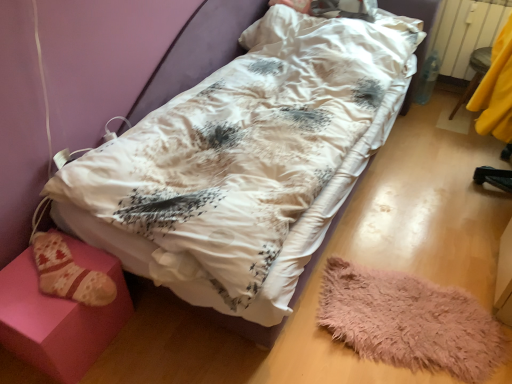
Question: In the image, is white satin hospital bed at center positioned in front of or behind pink fabric stool at lower left, which appears as the first furniture when viewed from the left?

Choices:
 (A) front
 (B) behind

Answer: (A)

Question: Do you think white satin hospital bed at center is within pink fabric stool at lower left, the first furniture ordered from the bottom, or outside of it?

Choices:
 (A) inside
 (B) outside

Answer: (B)

Question: Based on their relative distances, which object is farther from the white satin hospital bed at center?

Choices:
 (A) fluffy pink mat at lower right
 (B) white plastic radiator at upper right
 (C) pink fabric stool at lower left, which is the 2th furniture in back-to-front order
 (D) yellow fabric at right, arranged as the second furniture when viewed from the front

Answer: (D)

Question: Which object is positioned farthest from the fluffy pink mat at lower right?

Choices:
 (A) white satin hospital bed at center
 (B) white plastic radiator at upper right
 (C) pink fabric stool at lower left, the second furniture viewed from the top
 (D) yellow fabric at right, which is the 1th furniture in right-to-left order

Answer: (B)